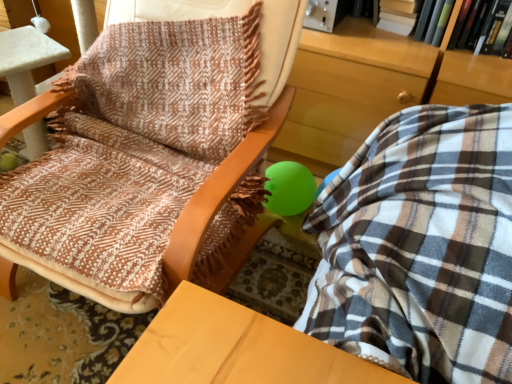
What is the approximate width of white paper book at upper right, which is the 3th book in right-to-left order?

7.72 inches.

Where is `green matte book at upper right, acting as the 2th book starting from the left`? The image size is (512, 384). green matte book at upper right, acting as the 2th book starting from the left is located at coordinates (438, 22).

Measure the distance between point (101, 185) and camera.

Point (101, 185) and camera are 1.09 meters apart.

Image resolution: width=512 pixels, height=384 pixels. In order to click on hardcover book at upper right, which appears as the third book when viewed from the left in this screenshot , I will do `click(478, 24)`.

Can you see white paper book at upper right, which is the 3th book in right-to-left order, touching green matte book at upper right, the 2th book from the right?

No, white paper book at upper right, which is the 3th book in right-to-left order, is not making contact with green matte book at upper right, the 2th book from the right.

Could you tell me if white paper book at upper right, which appears as the 1th book when viewed from the left, is facing green matte book at upper right, acting as the 2th book starting from the left?

No, white paper book at upper right, which appears as the 1th book when viewed from the left, does not turn towards green matte book at upper right, acting as the 2th book starting from the left.

Do you think white paper book at upper right, which is the 3th book in right-to-left order, is within green matte book at upper right, acting as the 2th book starting from the left, or outside of it?

white paper book at upper right, which is the 3th book in right-to-left order, is spatially situated outside green matte book at upper right, acting as the 2th book starting from the left.

Does brown woven fabric at center have a lesser height compared to green matte book at upper right, the 2th book from the right?

No.

Which is more to the left, brown woven fabric at center or green matte book at upper right, acting as the 2th book starting from the left?

brown woven fabric at center.

Is point (220, 209) positioned before point (438, 30)?

Yes, it is in front of point (438, 30).

Identify the location of chair directly beneath the green matte book at upper right, the 2th book from the right (from a real-world perspective). The image size is (512, 384). (143, 185).

Considering the sizes of objects brown woven fabric at center and hardcover book at upper right, which ranks as the first book in right-to-left order, in the image provided, who is shorter, brown woven fabric at center or hardcover book at upper right, which ranks as the first book in right-to-left order,?

With less height is hardcover book at upper right, which ranks as the first book in right-to-left order.

Considering the relative sizes of brown woven fabric at center and hardcover book at upper right, which appears as the third book when viewed from the left, in the image provided, is brown woven fabric at center bigger than hardcover book at upper right, which appears as the third book when viewed from the left,?

Correct, brown woven fabric at center is larger in size than hardcover book at upper right, which appears as the third book when viewed from the left.

Identify the location of the 1st book above the brown woven fabric at center (from the image's perspective). This screenshot has height=384, width=512. (478, 24).

Is brown woven fabric at center to the left of hardcover book at upper right, which ranks as the first book in right-to-left order, from the viewer's perspective?

Yes, brown woven fabric at center is to the left of hardcover book at upper right, which ranks as the first book in right-to-left order.

Who is bigger, green matte book at upper right, acting as the 2th book starting from the left, or hardcover book at upper right, which ranks as the first book in right-to-left order?

green matte book at upper right, acting as the 2th book starting from the left.

Is green matte book at upper right, acting as the 2th book starting from the left, taller or shorter than hardcover book at upper right, which ranks as the first book in right-to-left order?

Considering their sizes, green matte book at upper right, acting as the 2th book starting from the left, has more height than hardcover book at upper right, which ranks as the first book in right-to-left order.

From the image's perspective, is green matte book at upper right, the 2th book from the right, positioned above or below hardcover book at upper right, which appears as the third book when viewed from the left?

green matte book at upper right, the 2th book from the right, is situated higher than hardcover book at upper right, which appears as the third book when viewed from the left, in the image.

Locate an element on the screen. Image resolution: width=512 pixels, height=384 pixels. book located in front of the green matte book at upper right, the 2th book from the right is located at coordinates click(x=478, y=24).

Where is `the 3rd book to the right of the brown woven fabric at center, counting from the anchor's position`? the 3rd book to the right of the brown woven fabric at center, counting from the anchor's position is located at coordinates (478, 24).

Does hardcover book at upper right, which appears as the third book when viewed from the left, turn towards brown woven fabric at center?

No, hardcover book at upper right, which appears as the third book when viewed from the left, does not turn towards brown woven fabric at center.

Does point (474, 38) come behind point (133, 302)?

Yes, point (474, 38) is behind point (133, 302).

From a real-world perspective, is hardcover book at upper right, which ranks as the first book in right-to-left order, above or below brown woven fabric at center?

hardcover book at upper right, which ranks as the first book in right-to-left order, is above brown woven fabric at center.

In the scene shown: From their relative heights in the image, would you say white paper book at upper right, which appears as the 1th book when viewed from the left, is taller or shorter than hardcover book at upper right, which appears as the third book when viewed from the left?

Considering their sizes, white paper book at upper right, which appears as the 1th book when viewed from the left, has less height than hardcover book at upper right, which appears as the third book when viewed from the left.

Which is behind, point (391, 7) or point (490, 46)?

Positioned behind is point (391, 7).

Considering the relative positions of white paper book at upper right, which appears as the 1th book when viewed from the left, and hardcover book at upper right, which ranks as the first book in right-to-left order, in the image provided, is white paper book at upper right, which appears as the 1th book when viewed from the left, behind hardcover book at upper right, which ranks as the first book in right-to-left order,?

That is True.

Is white paper book at upper right, which is the 3th book in right-to-left order, oriented towards hardcover book at upper right, which appears as the third book when viewed from the left?

No, white paper book at upper right, which is the 3th book in right-to-left order, does not turn towards hardcover book at upper right, which appears as the third book when viewed from the left.

Between brown woven fabric at center and white paper book at upper right, which appears as the 1th book when viewed from the left, which one appears on the right side from the viewer's perspective?

white paper book at upper right, which appears as the 1th book when viewed from the left.

The image size is (512, 384). I want to click on chair below the white paper book at upper right, which is the 3th book in right-to-left order (from a real-world perspective), so coord(143,185).

Would you say brown woven fabric at center is outside white paper book at upper right, which is the 3th book in right-to-left order?

brown woven fabric at center lies outside white paper book at upper right, which is the 3th book in right-to-left order,'s area.

Could you tell me if brown woven fabric at center is turned towards white paper book at upper right, which appears as the 1th book when viewed from the left?

No.

Where is `book that is the 1st object located in front of the white paper book at upper right, which is the 3th book in right-to-left order`? book that is the 1st object located in front of the white paper book at upper right, which is the 3th book in right-to-left order is located at coordinates (438, 22).

You are a GUI agent. You are given a task and a screenshot of the screen. Output one action in this format:
    pyautogui.click(x=<x>, y=<y>)
    Task: Click on the chair beneath the green matte book at upper right, acting as the 2th book starting from the left (from a real-world perspective)
    
    Given the screenshot: What is the action you would take?
    pyautogui.click(x=143, y=185)

When comparing their distances from hardcover book at upper right, which appears as the third book when viewed from the left, does white paper book at upper right, which appears as the 1th book when viewed from the left, or brown woven fabric at center seem further?

brown woven fabric at center is further to hardcover book at upper right, which appears as the third book when viewed from the left.

Estimate the real-world distances between objects in this image. Which object is closer to white paper book at upper right, which appears as the 1th book when viewed from the left, hardcover book at upper right, which ranks as the first book in right-to-left order, or brown woven fabric at center?

hardcover book at upper right, which ranks as the first book in right-to-left order, is positioned closer to the anchor white paper book at upper right, which appears as the 1th book when viewed from the left.

When comparing their distances from brown woven fabric at center, does white paper book at upper right, which appears as the 1th book when viewed from the left, or hardcover book at upper right, which appears as the third book when viewed from the left, seem further?

hardcover book at upper right, which appears as the third book when viewed from the left, lies further to brown woven fabric at center than the other object.

Based on their spatial positions, is white paper book at upper right, which appears as the 1th book when viewed from the left, or green matte book at upper right, acting as the 2th book starting from the left, closer to hardcover book at upper right, which appears as the third book when viewed from the left?

green matte book at upper right, acting as the 2th book starting from the left, lies closer to hardcover book at upper right, which appears as the third book when viewed from the left, than the other object.

Estimate the real-world distances between objects in this image. Which object is closer to green matte book at upper right, the 2th book from the right, brown woven fabric at center or hardcover book at upper right, which appears as the third book when viewed from the left?

hardcover book at upper right, which appears as the third book when viewed from the left, is positioned closer to the anchor green matte book at upper right, the 2th book from the right.

From the image, which object appears to be nearer to green matte book at upper right, the 2th book from the right, hardcover book at upper right, which ranks as the first book in right-to-left order, or brown woven fabric at center?

hardcover book at upper right, which ranks as the first book in right-to-left order, lies closer to green matte book at upper right, the 2th book from the right, than the other object.

Based on their spatial positions, is white paper book at upper right, which is the 3th book in right-to-left order, or brown woven fabric at center closer to green matte book at upper right, the 2th book from the right?

Based on the image, white paper book at upper right, which is the 3th book in right-to-left order, appears to be nearer to green matte book at upper right, the 2th book from the right.

Which object lies further to the anchor point hardcover book at upper right, which ranks as the first book in right-to-left order, brown woven fabric at center or green matte book at upper right, acting as the 2th book starting from the left?

brown woven fabric at center is positioned further to the anchor hardcover book at upper right, which ranks as the first book in right-to-left order.

Identify the location of book between white paper book at upper right, which is the 3th book in right-to-left order, and hardcover book at upper right, which appears as the third book when viewed from the left. This screenshot has width=512, height=384. (438, 22).

This screenshot has height=384, width=512. What are the coordinates of `book located between brown woven fabric at center and green matte book at upper right, acting as the 2th book starting from the left, in the left-right direction` in the screenshot? It's located at (398, 15).